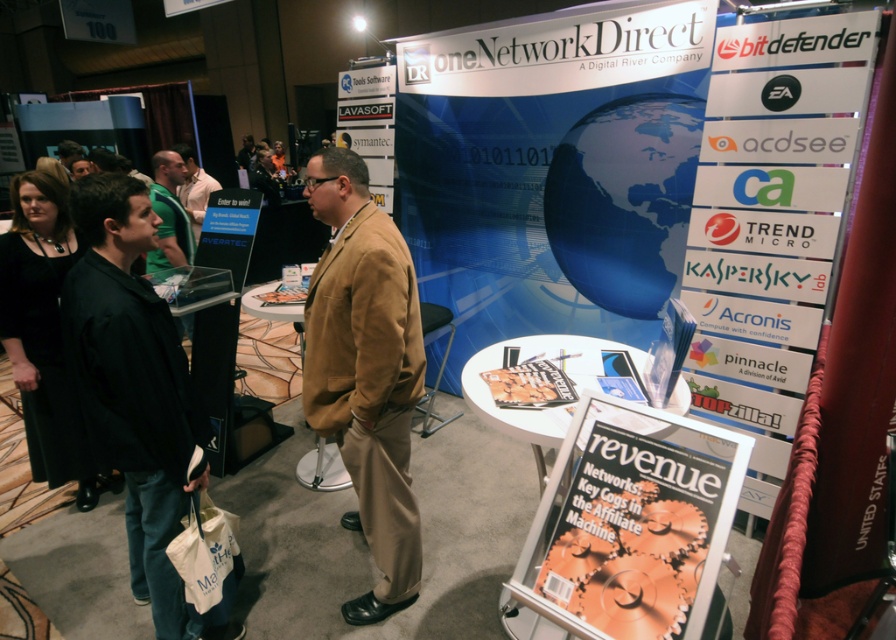
Between green fabric shirt at upper left and white shirt at center, which one has more height?

green fabric shirt at upper left is taller.

Consider the image. Does green fabric shirt at upper left have a lesser height compared to white shirt at center?

Incorrect, green fabric shirt at upper left's height does not fall short of white shirt at center's.

The image size is (896, 640). What do you see at coordinates (169, 214) in the screenshot?
I see `green fabric shirt at upper left` at bounding box center [169, 214].

This screenshot has width=896, height=640. In order to click on green fabric shirt at upper left in this screenshot , I will do `click(169, 214)`.

Measure the distance between point (785, 40) and camera.

Point (785, 40) and camera are 2.40 meters apart from each other.

Looking at this image, does white paper sign at right appear over matte white magazine at center?

Indeed, white paper sign at right is positioned over matte white magazine at center.

Where is `white paper sign at right`? white paper sign at right is located at coordinates (773, 182).

Can you confirm if matte white magazine at center is positioned above white plastic sign at upper center?

No, matte white magazine at center is not above white plastic sign at upper center.

Between matte white magazine at center and white plastic sign at upper center, which one is positioned lower?

matte white magazine at center is lower down.

What are the coordinates of `matte white magazine at center` in the screenshot? It's located at (636, 536).